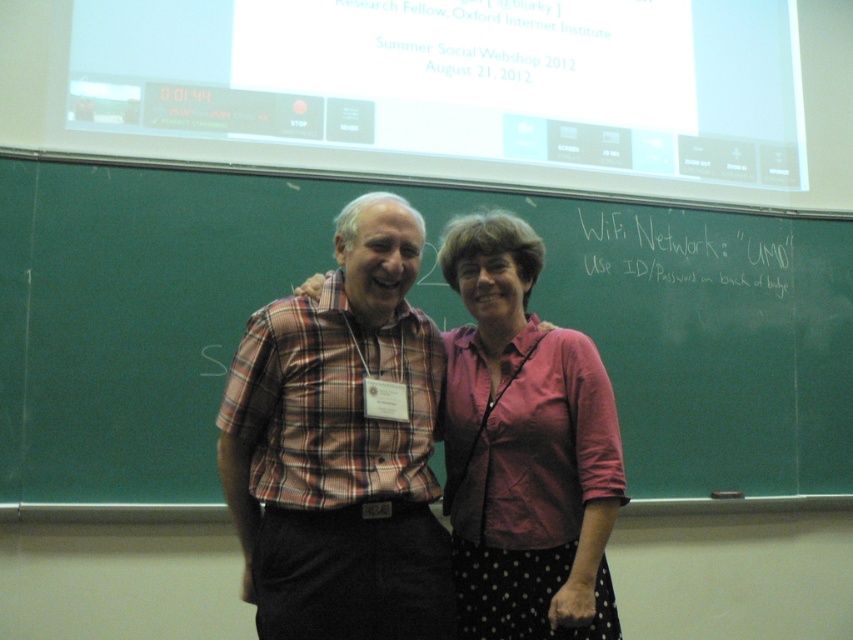
Who is shorter, green chalkboard at center or plaid shirt at center?

Standing shorter between the two is plaid shirt at center.

Where is `green chalkboard at center`? The width and height of the screenshot is (853, 640). green chalkboard at center is located at coordinates (415, 305).

Image resolution: width=853 pixels, height=640 pixels. In order to click on green chalkboard at center in this screenshot , I will do `click(415, 305)`.

Can you confirm if green chalkboard at center is positioned below pink fabric shirt at center?

Actually, green chalkboard at center is above pink fabric shirt at center.

Does point (44, 282) come farther from viewer compared to point (598, 637)?

Yes, it is behind point (598, 637).

At what (x,y) coordinates should I click in order to perform the action: click on green chalkboard at center. Please return your answer as a coordinate pair (x, y). The image size is (853, 640). Looking at the image, I should click on (415, 305).

Does plaid shirt at center have a larger size compared to pink fabric shirt at center?

Yes.

Is point (397, 381) closer to viewer compared to point (520, 612)?

No, (397, 381) is further to viewer.

Who is more forward, [253,400] or [537,540]?

Point [253,400] is more forward.

This screenshot has height=640, width=853. Identify the location of plaid shirt at center. (341, 445).